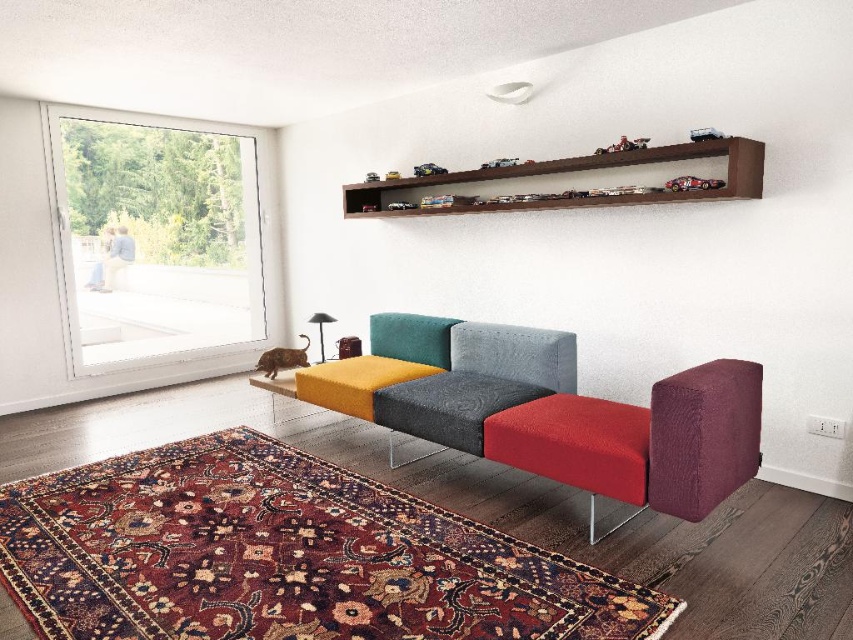
You are an interior designer planning to place a large painting that is 2 meters wide. You see the transparent glass door at left and the wooden shelf at upper center. Which object can accommodate the painting in terms of width?

The wooden shelf at upper center can accommodate the painting since its width is greater than the transparent glass door at left.

You are standing in the living room and want to reach the sliding glass door. The point marked as point (248, 214) is directly in front of you. Can you walk straight towards the sliding glass door without any obstruction?

The distance between you and point (248, 214) is 6.02 meters. Since the point is directly in front of you and there are no objects mentioned blocking the path, you can walk straight towards the sliding glass door without obstruction.

You are standing in the living room and want to determine which of the two points, point (88, 320) or point (508, 172), is closer to you. Based on the scene description, which point is nearer?

Point (88, 320) is further to the viewer than point (508, 172). Wait, no, the description says the opposite. Let me check again. The Objects Description states that point (88, 320) is further to the viewer than point (508, 172). Hmm, so actually, point (508, 172) is closer to the viewer. Therefore, the answer should be point (508, 172) is closer. But the question asks which is nearer, so the answer is point (508, 172). Wait, but the Objects Description says point A is further than point B,so